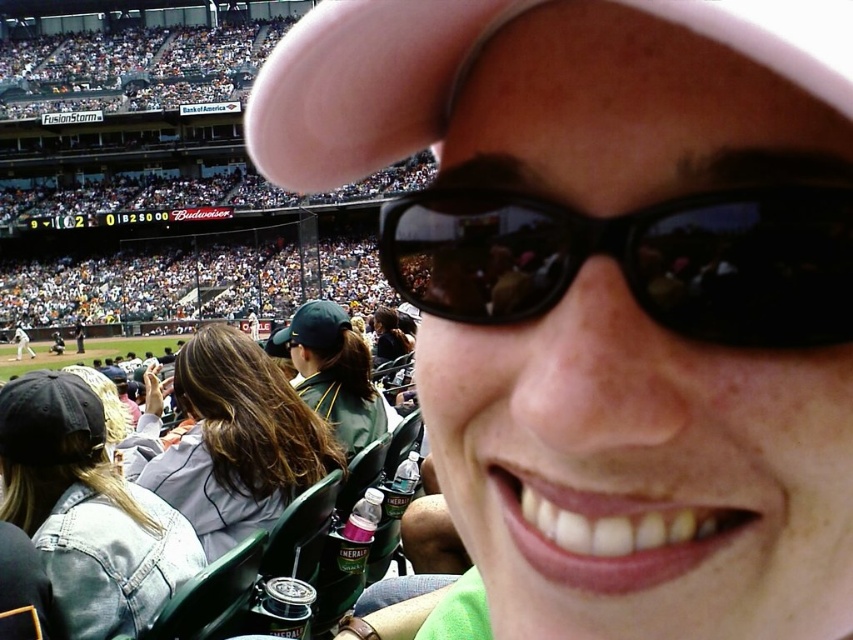
Question: Which point appears farthest from the camera in this image?

Choices:
 (A) (253, 464)
 (B) (308, 346)

Answer: (B)

Question: Considering the relative positions of denim jacket at lower left and green fabric cap at center in the image provided, where is denim jacket at lower left located with respect to green fabric cap at center?

Choices:
 (A) right
 (B) left

Answer: (B)

Question: Which object appears farthest from the camera in this image?

Choices:
 (A) black fabric cap at lower left
 (B) green jersey at center

Answer: (B)

Question: Is the position of denim jacket at lower left less distant than that of green jersey at center?

Choices:
 (A) yes
 (B) no

Answer: (A)

Question: Among these points, which one is nearest to the camera?

Choices:
 (A) (318, 348)
 (B) (85, 564)
 (C) (651, 282)
 (D) (27, 353)

Answer: (C)

Question: Does pink fabric cap at upper center appear on the left side of white cotton baseball uniform at center?

Choices:
 (A) yes
 (B) no

Answer: (B)